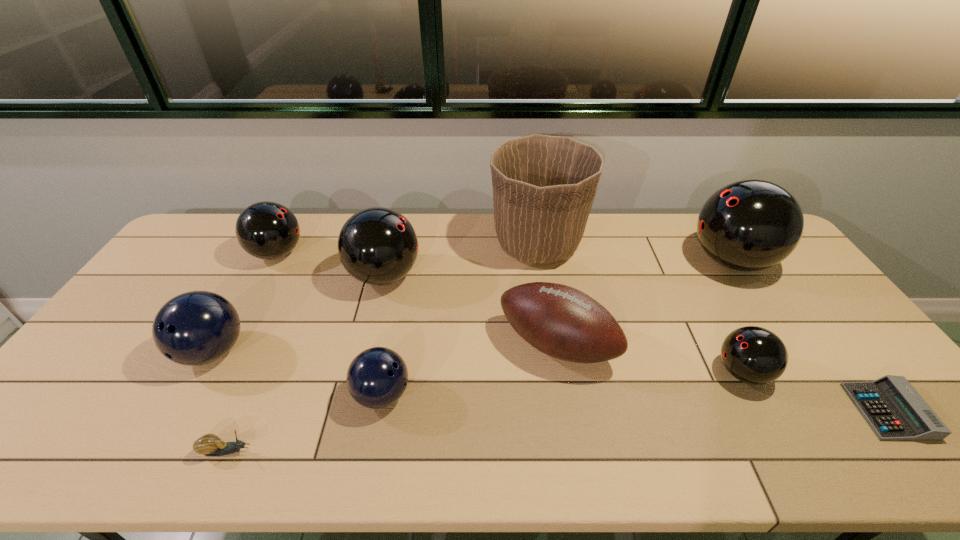
Identify the location of calculator that is at the near edge. (894, 410).

Where is `bowling ball that is positioned at the right edge`? The image size is (960, 540). bowling ball that is positioned at the right edge is located at coordinates (749, 225).

Image resolution: width=960 pixels, height=540 pixels. What are the coordinates of `calculator that is at the right edge` in the screenshot? It's located at pos(894,410).

Locate an element on the screen. Image resolution: width=960 pixels, height=540 pixels. object at the far right corner is located at coordinates (749, 225).

You are a GUI agent. You are given a task and a screenshot of the screen. Output one action in this format:
    pyautogui.click(x=<x>, y=<y>)
    Task: Click on the object located at the near right corner
    This screenshot has height=540, width=960.
    Given the screenshot: What is the action you would take?
    pyautogui.click(x=894, y=410)

This screenshot has width=960, height=540. In the image, there is a desktop. What are the coordinates of `vacant space at the far edge` in the screenshot? It's located at (307, 228).

Locate an element on the screen. The width and height of the screenshot is (960, 540). vacant region at the near edge of the desktop is located at coordinates (704, 464).

Locate an element on the screen. vacant space at the left edge is located at coordinates 166,281.

Identify the location of free space at the right edge. (814, 293).

Where is `vacant area at the far left corner`? Image resolution: width=960 pixels, height=540 pixels. vacant area at the far left corner is located at coordinates (224, 218).